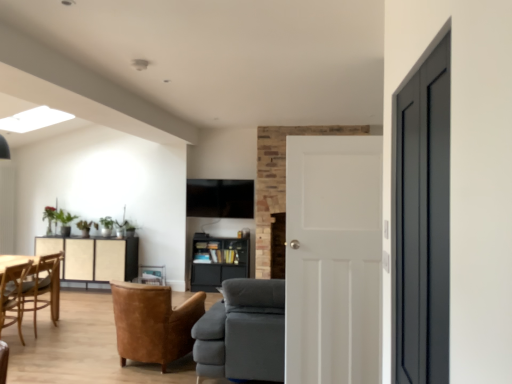
Question: Considering the relative sizes of wooden chair at lower left, which is the 1th chair in back-to-front order, and matte black bookshelf at center in the image provided, is wooden chair at lower left, which is the 1th chair in back-to-front order, smaller than matte black bookshelf at center?

Choices:
 (A) no
 (B) yes

Answer: (B)

Question: From the image's perspective, is wooden chair at lower left, acting as the 1th chair starting from the left, located beneath matte black bookshelf at center?

Choices:
 (A) no
 (B) yes

Answer: (A)

Question: Can you confirm if wooden chair at lower left, the 2th chair viewed from the front, is wider than matte black bookshelf at center?

Choices:
 (A) yes
 (B) no

Answer: (A)

Question: From a real-world perspective, is wooden chair at lower left, which is the 1th chair in back-to-front order, physically below matte black bookshelf at center?

Choices:
 (A) yes
 (B) no

Answer: (B)

Question: Is wooden chair at lower left, which is the 1th chair in back-to-front order, facing towards matte black bookshelf at center?

Choices:
 (A) no
 (B) yes

Answer: (A)

Question: Is matte black door at right, the second door from the back, wider or thinner than gray fabric couch at center?

Choices:
 (A) wide
 (B) thin

Answer: (B)

Question: From the image's perspective, relative to gray fabric couch at center, is matte black door at right, which ranks as the 1th door in front-to-back order, above or below?

Choices:
 (A) above
 (B) below

Answer: (A)

Question: From a real-world perspective, is matte black door at right, which ranks as the 1th door in front-to-back order, physically located above or below gray fabric couch at center?

Choices:
 (A) above
 (B) below

Answer: (A)

Question: In the image, is matte black door at right, which ranks as the 1th door in front-to-back order, positioned in front of or behind gray fabric couch at center?

Choices:
 (A) front
 (B) behind

Answer: (A)

Question: Which is correct: leather armchair at center, the first chair positioned from the right, is inside gray fabric couch at center, or outside of it?

Choices:
 (A) outside
 (B) inside

Answer: (A)

Question: Does point (181, 352) appear closer or farther from the camera than point (257, 369)?

Choices:
 (A) closer
 (B) farther

Answer: (B)

Question: Is leather armchair at center, placed as the second chair when sorted from left to right, in front of or behind gray fabric couch at center in the image?

Choices:
 (A) behind
 (B) front

Answer: (A)

Question: Considering the positions of leather armchair at center, the second chair in the back-to-front sequence, and gray fabric couch at center in the image, is leather armchair at center, the second chair in the back-to-front sequence, bigger or smaller than gray fabric couch at center?

Choices:
 (A) big
 (B) small

Answer: (B)

Question: In the image, is matte black door at right, which ranks as the 1th door in front-to-back order, on the left side or the right side of white matte door at center, acting as the 1th door starting from the back?

Choices:
 (A) left
 (B) right

Answer: (B)

Question: In the image, is matte black door at right, which ranks as the 1th door in front-to-back order, positioned in front of or behind white matte door at center, acting as the 1th door starting from the back?

Choices:
 (A) front
 (B) behind

Answer: (A)